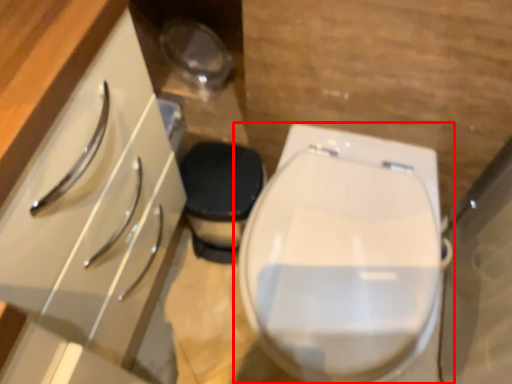
Question: From the image's perspective, where is toilet (annotated by the red box) located in relation to cabinetry in the image?

Choices:
 (A) above
 (B) below

Answer: (B)